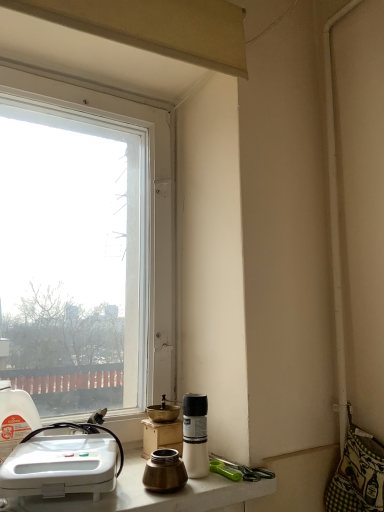
Where is `free space between white plastic sink at lower left and brass metallic coffee cup at lower center`? The width and height of the screenshot is (384, 512). free space between white plastic sink at lower left and brass metallic coffee cup at lower center is located at coordinates (136, 490).